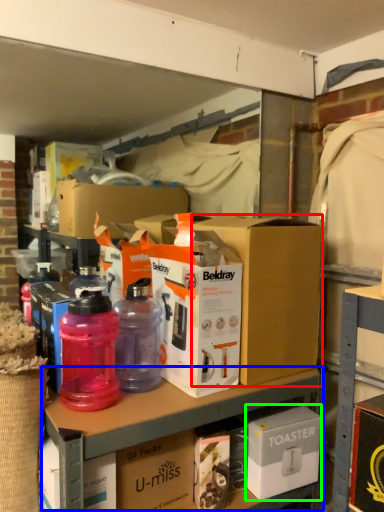
Question: Estimate the real-world distances between objects in this image. Which object is closer to box (highlighted by a red box), workbench (highlighted by a blue box) or box (highlighted by a green box)?

Choices:
 (A) workbench
 (B) box

Answer: (A)